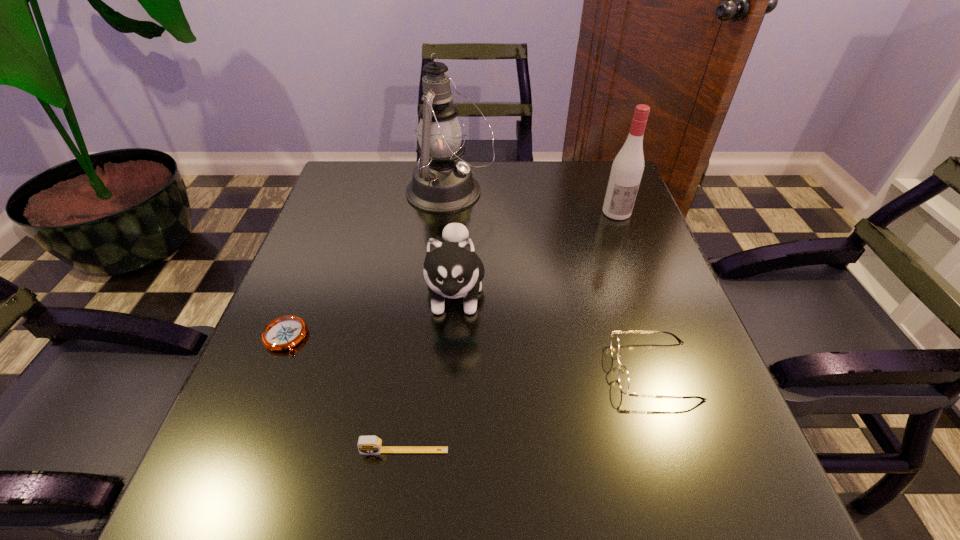
Where is `oil lamp`? The height and width of the screenshot is (540, 960). oil lamp is located at coordinates click(x=442, y=183).

Identify the location of the second tallest object. (627, 169).

Find the location of a particular element. the third tallest object is located at coordinates (452, 269).

The width and height of the screenshot is (960, 540). I want to click on the fourth tallest object, so [x=623, y=376].

At what (x,y) coordinates should I click in order to perform the action: click on tape measure. Please return your answer as a coordinate pair (x, y). Looking at the image, I should click on (370, 445).

The height and width of the screenshot is (540, 960). I want to click on the nearest object, so click(370, 445).

Locate an element on the screen. The width and height of the screenshot is (960, 540). the shortest object is located at coordinates (283, 333).

Image resolution: width=960 pixels, height=540 pixels. What are the coordinates of `the leftmost object` in the screenshot? It's located at (283, 333).

I want to click on vacant space positioned on the left of the oil lamp, so [348, 193].

The width and height of the screenshot is (960, 540). I want to click on free space located 0.210m on the label of the alcohol, so [641, 278].